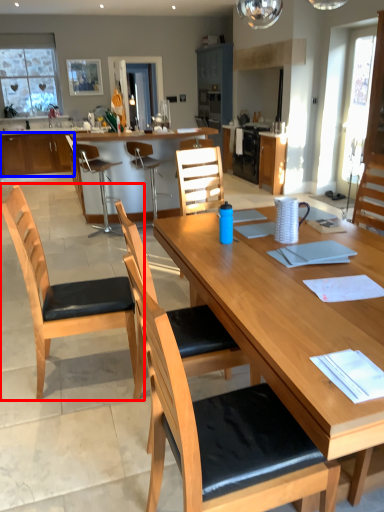
Question: Among these objects, which one is nearest to the camera, chair (highlighted by a red box) or cabinetry (highlighted by a blue box)?

Choices:
 (A) chair
 (B) cabinetry

Answer: (A)